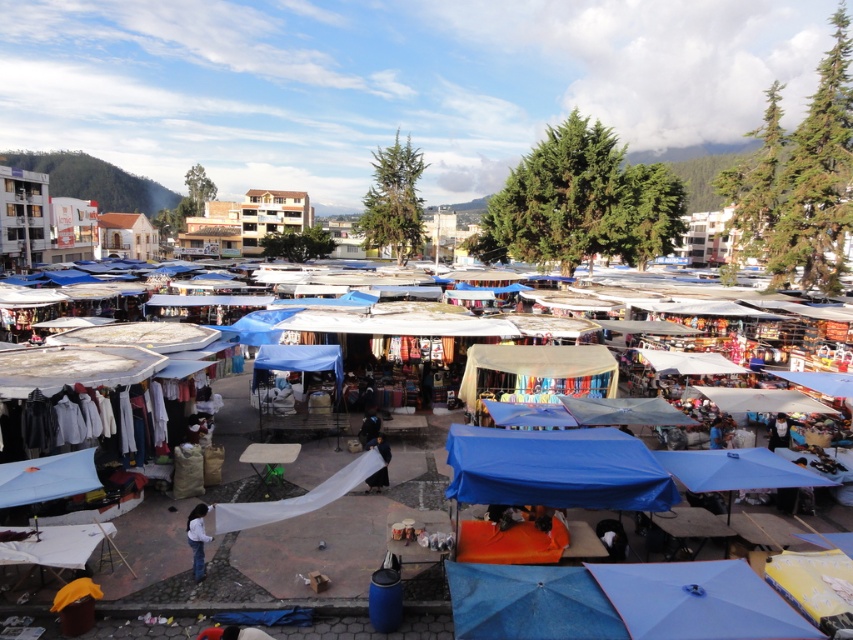
You are standing at the entrance of the market and want to find the dark blue fabric at center. According to the coordinates provided, in which direction should you walk to reach it?

The dark blue fabric at center is located at coordinates point [375,448], so you should walk towards the center of the market to reach it.

You are a customer at the market and want to place a small item on the dark blue fabric at center. However, you notice the white fabric at lower left nearby. Which fabric would you choose to place your item to avoid it being hidden by the other fabric?

The white fabric at lower left is taller than the dark blue fabric at center, so placing the item on the dark blue fabric at center would prevent it from being hidden by the taller white fabric at lower left.